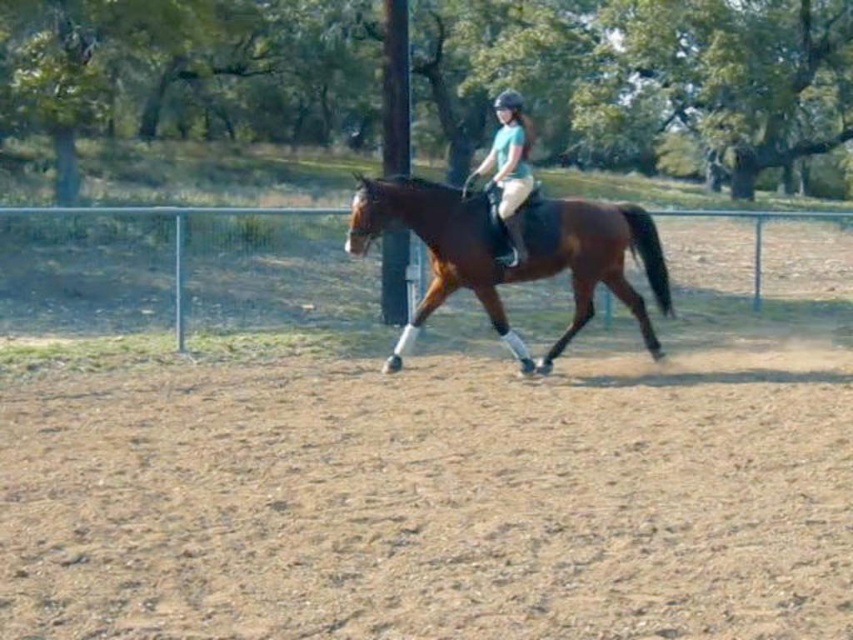
Does brown sandy ground at lower center appear under green wire fence at center?

Yes, brown sandy ground at lower center is below green wire fence at center.

Which is below, brown sandy ground at lower center or green wire fence at center?

brown sandy ground at lower center is below.

Is point (747, 605) positioned before point (757, 278)?

Yes.

Image resolution: width=853 pixels, height=640 pixels. Identify the location of brown sandy ground at lower center. (432, 500).

Measure the distance between point (407, 205) and camera.

Point (407, 205) is 33.53 feet away from camera.

Looking at this image, between brown glossy horse at center and green wire fence at center, which one has less height?

brown glossy horse at center is shorter.

What do you see at coordinates (503, 252) in the screenshot? The width and height of the screenshot is (853, 640). I see `brown glossy horse at center` at bounding box center [503, 252].

Image resolution: width=853 pixels, height=640 pixels. I want to click on brown glossy horse at center, so click(x=503, y=252).

Does green wire fence at center have a greater width compared to matte green shirt at center?

Yes, green wire fence at center is wider than matte green shirt at center.

Between green wire fence at center and matte green shirt at center, which one is positioned higher?

matte green shirt at center is higher up.

Between point (45, 211) and point (518, 209), which one is positioned behind?

The point (45, 211) is more distant.

The width and height of the screenshot is (853, 640). I want to click on green wire fence at center, so click(x=173, y=230).